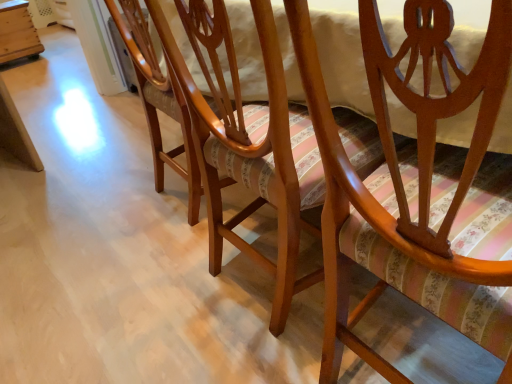
Question: Should I look upward or downward to see wooden crate at left?

Choices:
 (A) down
 (B) up

Answer: (B)

Question: From the image's perspective, does wooden chair at center, positioned as the 1th chair in left-to-right order, appear higher than matte wood chair at center, which is counted as the 2th chair, starting from the left?

Choices:
 (A) no
 (B) yes

Answer: (B)

Question: Is wooden chair at center, the 2th chair positioned from the right, behind matte wood chair at center, the first chair when ordered from front to back?

Choices:
 (A) no
 (B) yes

Answer: (B)

Question: From the image's perspective, is wooden chair at center, the 2th chair positioned from the right, under matte wood chair at center, the first chair when ordered from front to back?

Choices:
 (A) yes
 (B) no

Answer: (B)

Question: Is wooden chair at center, which ranks as the 1th chair in back-to-front order, outside matte wood chair at center, which is counted as the 2th chair, starting from the left?

Choices:
 (A) no
 (B) yes

Answer: (B)

Question: From a real-world perspective, is wooden chair at center, the 2th chair positioned from the right, on matte wood chair at center, placed as the second chair when sorted from back to front?

Choices:
 (A) no
 (B) yes

Answer: (A)

Question: Considering the relative sizes of wooden chair at center, positioned as the 1th chair in left-to-right order, and matte wood chair at center, placed as the second chair when sorted from back to front, in the image provided, is wooden chair at center, positioned as the 1th chair in left-to-right order, thinner than matte wood chair at center, placed as the second chair when sorted from back to front,?

Choices:
 (A) no
 (B) yes

Answer: (B)

Question: Is wooden crate at left facing away from matte wood chair at center, which is counted as the 2th chair, starting from the left?

Choices:
 (A) no
 (B) yes

Answer: (B)

Question: Considering the relative positions of wooden crate at left and matte wood chair at center, placed as the second chair when sorted from back to front, in the image provided, is wooden crate at left in front of matte wood chair at center, placed as the second chair when sorted from back to front,?

Choices:
 (A) no
 (B) yes

Answer: (A)

Question: Is wooden crate at left completely or partially outside of matte wood chair at center, the first chair when ordered from front to back?

Choices:
 (A) yes
 (B) no

Answer: (A)

Question: Can you confirm if wooden crate at left is positioned to the right of matte wood chair at center, which is counted as the 2th chair, starting from the left?

Choices:
 (A) no
 (B) yes

Answer: (A)

Question: From a real-world perspective, is wooden crate at left beneath matte wood chair at center, the first chair when ordered from front to back?

Choices:
 (A) no
 (B) yes

Answer: (B)

Question: Can you confirm if wooden crate at left is thinner than matte wood chair at center, which is counted as the 2th chair, starting from the left?

Choices:
 (A) yes
 (B) no

Answer: (A)

Question: Can you confirm if wooden crate at left is taller than wooden chair at center, positioned as the 1th chair in left-to-right order?

Choices:
 (A) no
 (B) yes

Answer: (A)